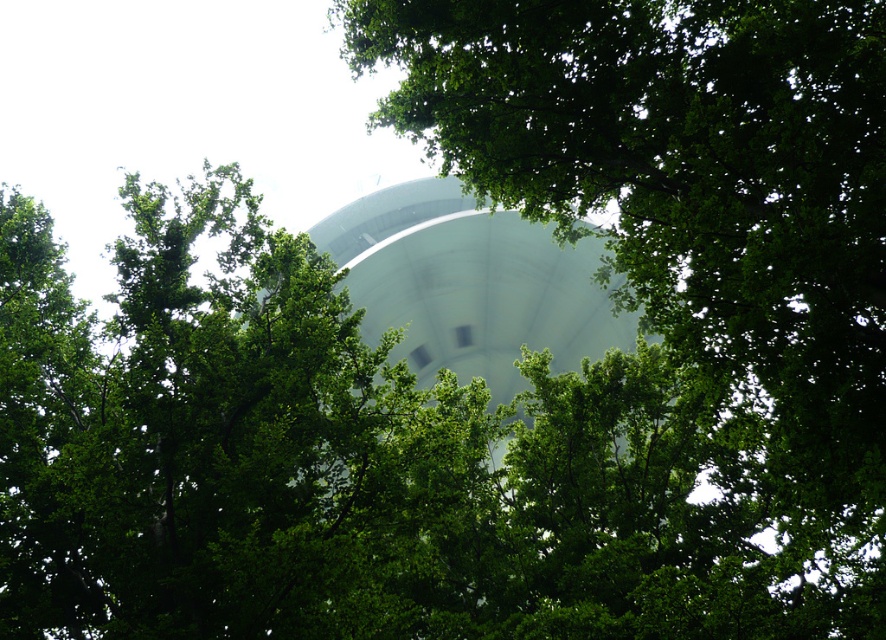
Looking at this image, you are standing in a forest clearing and see the green leafy tree at center and the white smooth water tower at center. Which object is located to the right of the other?

The green leafy tree at center is positioned on the right side of white smooth water tower at center.

You are standing in front of the large cylindrical structure and want to take a photo of the green leafy tree at center. Based on its position, which direction should you aim your camera to capture it?

The green leafy tree at center is located at point coordinates approximately 0.459 on the x and 0.772 on the y axis. Since it is at the center position, you should aim your camera directly ahead to capture the green leafy tree at center.

You are standing 20 feet away from the green leafy tree at center. Can you reach it without moving closer?

The green leafy tree at center is 20.58 feet away from the viewer, so you cannot reach it without moving closer since you are currently 20 feet away.